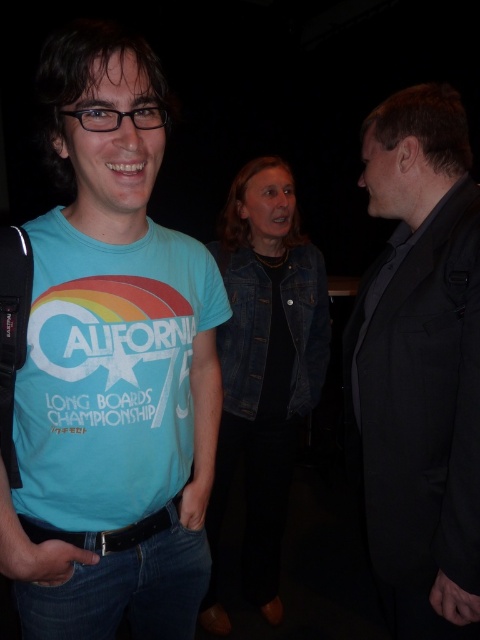
You are attending a formal event and need to decide where to place your coat. You see a black smooth suit at right and a denim jacket at center. Which item is positioned higher up in the image?

The black smooth suit at right is above the denim jacket at center, so it is positioned higher up in the image.